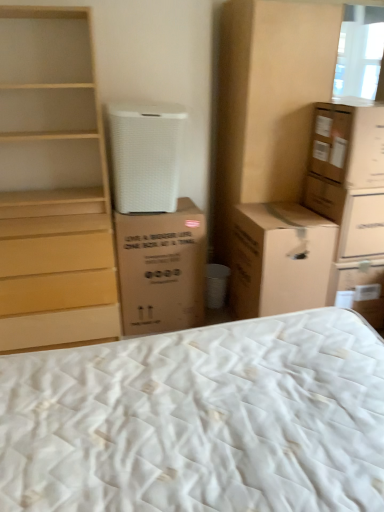
Question: Is the position of brown cardboard box at right, which is counted as the 1th cardboard box, starting from the right, more distant than that of brown cardboard box at upper right, marked as the third cardboard box in a right-to-left arrangement?

Choices:
 (A) yes
 (B) no

Answer: (A)

Question: Could you tell me if brown cardboard box at right, which is the fourth cardboard box in left-to-right order, is facing brown cardboard box at upper right, the 2th cardboard box positioned from the left?

Choices:
 (A) no
 (B) yes

Answer: (A)

Question: Is brown cardboard box at right, which is the fourth cardboard box in left-to-right order, outside of brown cardboard box at upper right, the 2th cardboard box positioned from the left?

Choices:
 (A) no
 (B) yes

Answer: (B)

Question: Is brown cardboard box at right, which is counted as the 1th cardboard box, starting from the right, thinner than brown cardboard box at upper right, marked as the third cardboard box in a right-to-left arrangement?

Choices:
 (A) yes
 (B) no

Answer: (A)

Question: From a real-world perspective, is brown cardboard box at right, which is the fourth cardboard box in left-to-right order, positioned under brown cardboard box at upper right, marked as the third cardboard box in a right-to-left arrangement, based on gravity?

Choices:
 (A) no
 (B) yes

Answer: (A)

Question: Does brown cardboard box at right, which is the fourth cardboard box in left-to-right order, have a greater width compared to brown cardboard box at upper right, the 2th cardboard box positioned from the left?

Choices:
 (A) yes
 (B) no

Answer: (B)

Question: Is light wood chest of drawers at left facing towards brown cardboard cabinet at upper right?

Choices:
 (A) yes
 (B) no

Answer: (B)

Question: Can you confirm if light wood chest of drawers at left is positioned to the right of brown cardboard cabinet at upper right?

Choices:
 (A) no
 (B) yes

Answer: (A)

Question: Is the depth of light wood chest of drawers at left greater than that of brown cardboard cabinet at upper right?

Choices:
 (A) yes
 (B) no

Answer: (B)

Question: Does light wood chest of drawers at left have a greater width compared to brown cardboard cabinet at upper right?

Choices:
 (A) no
 (B) yes

Answer: (A)

Question: Considering the relative sizes of light wood chest of drawers at left and brown cardboard cabinet at upper right in the image provided, is light wood chest of drawers at left smaller than brown cardboard cabinet at upper right?

Choices:
 (A) no
 (B) yes

Answer: (B)

Question: From a real-world perspective, is light wood chest of drawers at left positioned over brown cardboard cabinet at upper right based on gravity?

Choices:
 (A) no
 (B) yes

Answer: (A)

Question: Could you tell me if brown cardboard cabinet at upper right is facing light wood chest of drawers at left?

Choices:
 (A) no
 (B) yes

Answer: (A)